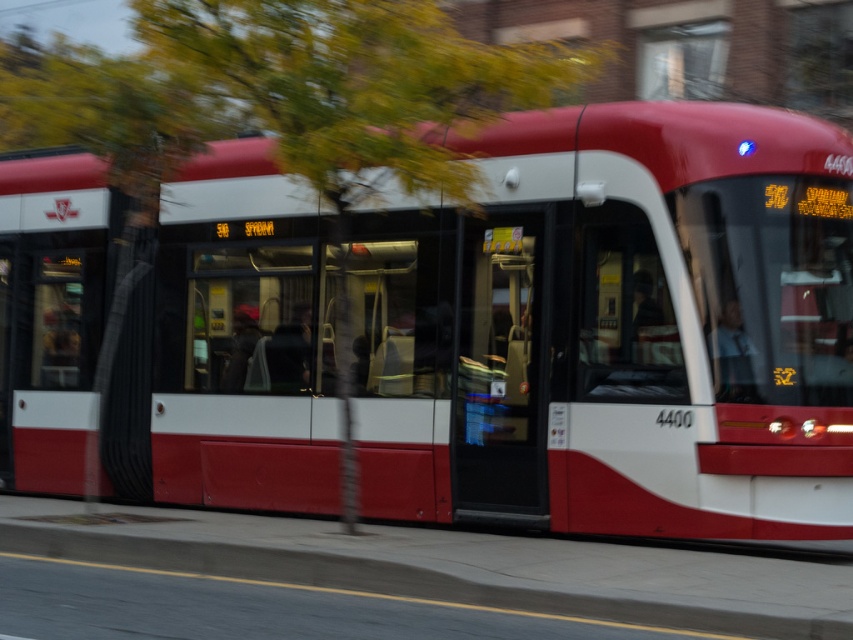
Can you confirm if matte red bus at center is thinner than green leafy tree at upper left?

Incorrect, matte red bus at center's width is not less than green leafy tree at upper left's.

Which is behind, point (15, 168) or point (480, 104)?

Positioned behind is point (15, 168).

Where is `matte red bus at center`? This screenshot has width=853, height=640. matte red bus at center is located at coordinates (618, 328).

Can you confirm if green leafy tree at upper left is positioned to the right of concrete at lower left?

Incorrect, green leafy tree at upper left is not on the right side of concrete at lower left.

Can you confirm if green leafy tree at upper left is positioned to the left of concrete at lower left?

Correct, you'll find green leafy tree at upper left to the left of concrete at lower left.

The height and width of the screenshot is (640, 853). What do you see at coordinates (354, 106) in the screenshot? I see `green leafy tree at upper left` at bounding box center [354, 106].

Locate an element on the screen. The height and width of the screenshot is (640, 853). green leafy tree at upper left is located at coordinates (354, 106).

In the scene shown: Can you confirm if matte red bus at center is thinner than concrete at lower left?

No, matte red bus at center is not thinner than concrete at lower left.

At what (x,y) coordinates should I click in order to perform the action: click on matte red bus at center. Please return your answer as a coordinate pair (x, y). Looking at the image, I should click on (618, 328).